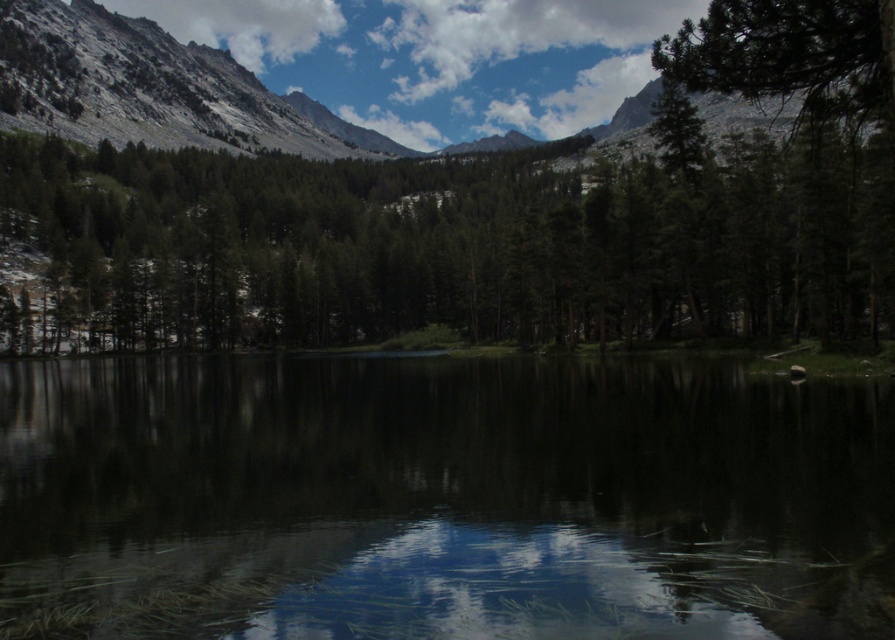
Does smooth reflective water at center appear under green matte tree at center?

Yes, smooth reflective water at center is below green matte tree at center.

Which is above, smooth reflective water at center or green matte tree at center?

green matte tree at center is higher up.

Who is more distant from viewer, (568, 547) or (501, 262)?

Point (501, 262)

Identify the location of smooth reflective water at center. This screenshot has width=895, height=640. (440, 499).